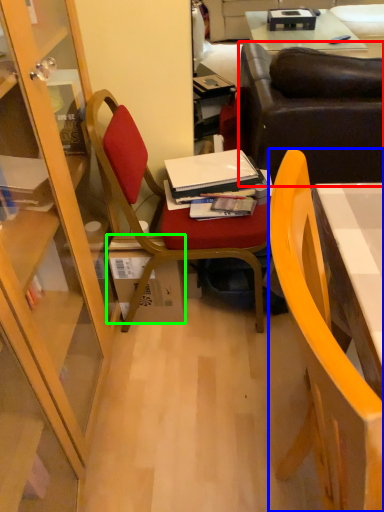
Question: Which is nearer to the studio couch (highlighted by a red box)? chair (highlighted by a blue box) or box (highlighted by a green box).

Choices:
 (A) chair
 (B) box

Answer: (B)